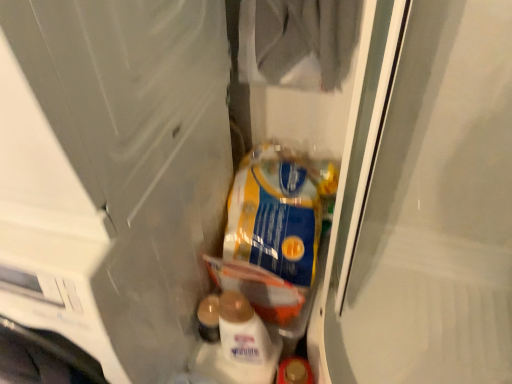
Question: Considering the relative positions of transparent plastic screen door at left, which is the second screen door in right-to-left order, and clear plastic bag at center, marked as the first screen door in a right-to-left arrangement, in the image provided, is transparent plastic screen door at left, which is the second screen door in right-to-left order, to the left of clear plastic bag at center, marked as the first screen door in a right-to-left arrangement, from the viewer's perspective?

Choices:
 (A) yes
 (B) no

Answer: (A)

Question: From a real-world perspective, is transparent plastic screen door at left, which is the second screen door in right-to-left order, over clear plastic bag at center, marked as the first screen door in a right-to-left arrangement?

Choices:
 (A) yes
 (B) no

Answer: (B)

Question: From the image's perspective, is transparent plastic screen door at left, marked as the 1th screen door in a left-to-right arrangement, above clear plastic bag at center, acting as the 2th screen door starting from the left?

Choices:
 (A) no
 (B) yes

Answer: (A)

Question: Is transparent plastic screen door at left, which is the second screen door in right-to-left order, not near clear plastic bag at center, marked as the first screen door in a right-to-left arrangement?

Choices:
 (A) no
 (B) yes

Answer: (A)

Question: Is transparent plastic screen door at left, marked as the 1th screen door in a left-to-right arrangement, looking in the opposite direction of clear plastic bag at center, acting as the 2th screen door starting from the left?

Choices:
 (A) no
 (B) yes

Answer: (A)

Question: From the image's perspective, is transparent plastic screen door at left, marked as the 1th screen door in a left-to-right arrangement, beneath clear plastic bag at center, acting as the 2th screen door starting from the left?

Choices:
 (A) no
 (B) yes

Answer: (B)

Question: Would you consider clear plastic bag at center, acting as the 2th screen door starting from the left, to be distant from blue/yellow plastic bag at center?

Choices:
 (A) no
 (B) yes

Answer: (A)

Question: From the image's perspective, is clear plastic bag at center, marked as the first screen door in a right-to-left arrangement, beneath blue/yellow plastic bag at center?

Choices:
 (A) no
 (B) yes

Answer: (A)

Question: From a real-world perspective, is clear plastic bag at center, marked as the first screen door in a right-to-left arrangement, physically above blue/yellow plastic bag at center?

Choices:
 (A) no
 (B) yes

Answer: (B)

Question: Is clear plastic bag at center, acting as the 2th screen door starting from the left, turned away from blue/yellow plastic bag at center?

Choices:
 (A) yes
 (B) no

Answer: (B)

Question: Is clear plastic bag at center, acting as the 2th screen door starting from the left, positioned beyond the bounds of blue/yellow plastic bag at center?

Choices:
 (A) no
 (B) yes

Answer: (B)

Question: Considering the relative sizes of clear plastic bag at center, acting as the 2th screen door starting from the left, and blue/yellow plastic bag at center in the image provided, is clear plastic bag at center, acting as the 2th screen door starting from the left, smaller than blue/yellow plastic bag at center?

Choices:
 (A) no
 (B) yes

Answer: (A)

Question: Considering the relative sizes of blue/yellow plastic bag at center and transparent plastic screen door at left, which is the second screen door in right-to-left order, in the image provided, is blue/yellow plastic bag at center wider than transparent plastic screen door at left, which is the second screen door in right-to-left order,?

Choices:
 (A) no
 (B) yes

Answer: (A)